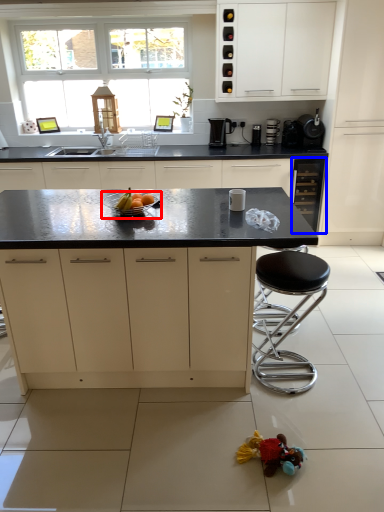
Question: Which object appears farthest to the camera in this image, bowl (highlighted by a red box) or cabinetry (highlighted by a blue box)?

Choices:
 (A) bowl
 (B) cabinetry

Answer: (B)